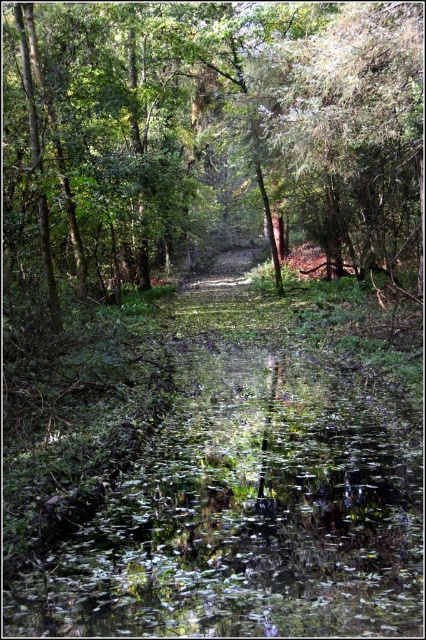
Does green leafy water at center appear on the left side of green leafy tree at upper right?

Correct, you'll find green leafy water at center to the left of green leafy tree at upper right.

Measure the distance between point (x=207, y=561) and camera.

Point (x=207, y=561) and camera are 15.09 feet apart from each other.

Measure the distance between point (140, 522) and camera.

The distance of point (140, 522) from camera is 17.18 feet.

Find the location of a particular element. The height and width of the screenshot is (640, 426). green leafy water at center is located at coordinates (250, 513).